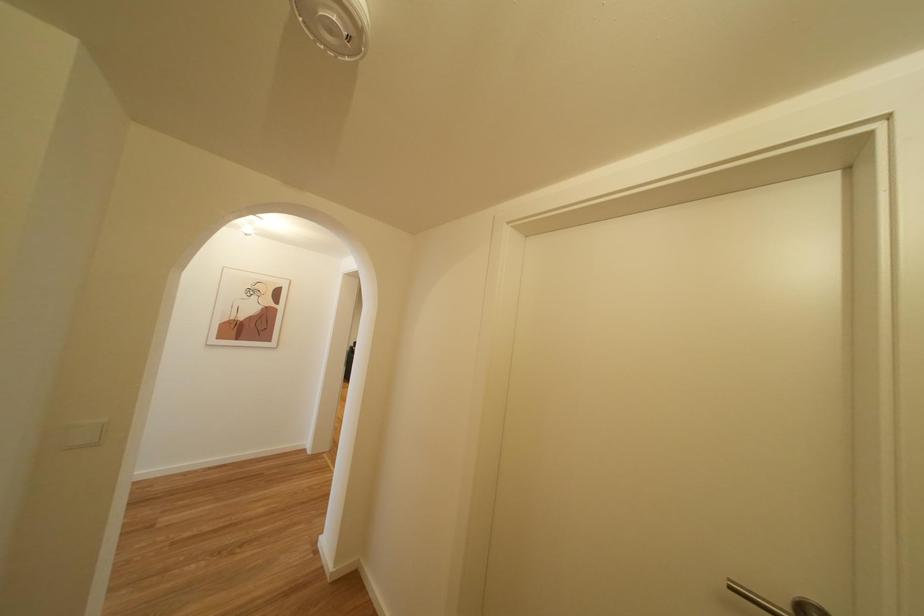
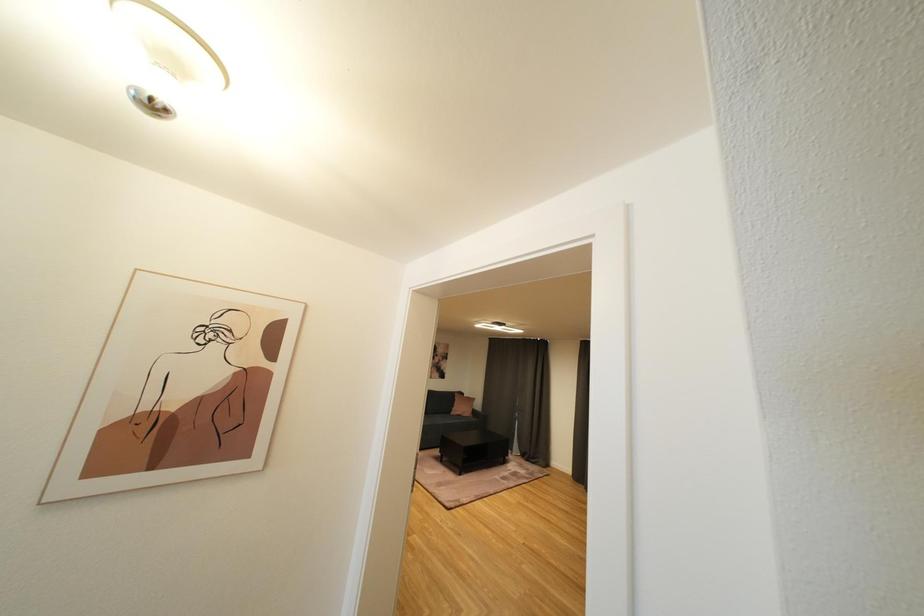
Which direction would the cameraman need to move to produce the second image?

The cameraman moved toward left, forward.